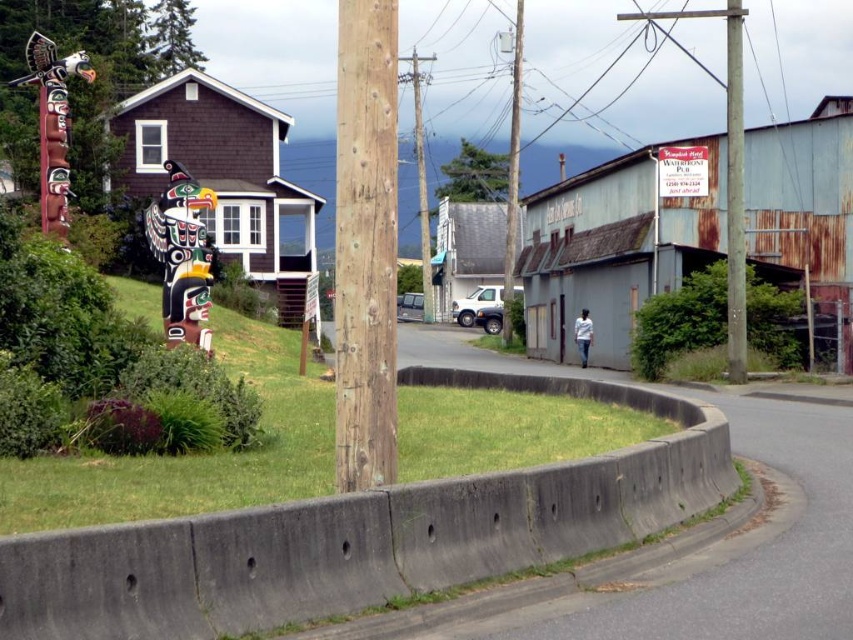
Is brown rough wood at center wider than polished wood totem pole at upper left?

No, brown rough wood at center is not wider than polished wood totem pole at upper left.

Who is more forward, (x=346, y=289) or (x=90, y=83)?

Point (x=346, y=289) is in front.

Where is `brown rough wood at center`? The image size is (853, 640). brown rough wood at center is located at coordinates (364, 243).

Is point (358, 468) positioned before point (735, 252)?

That is True.

The height and width of the screenshot is (640, 853). Find the location of `brown rough wood at center`. brown rough wood at center is located at coordinates (364, 243).

This screenshot has width=853, height=640. What are the coordinates of `brown rough wood at center` in the screenshot? It's located at (364, 243).

Who is positioned more to the right, smooth wooden pole at center or smooth wooden telegraph pole at center?

From the viewer's perspective, smooth wooden pole at center appears more on the right side.

Who is taller, smooth wooden pole at center or smooth wooden telegraph pole at center?

Standing taller between the two is smooth wooden pole at center.

Measure the distance between smooth wooden pole at center and camera.

The distance of smooth wooden pole at center from camera is 46.54 meters.

Locate an element on the screen. The width and height of the screenshot is (853, 640). smooth wooden pole at center is located at coordinates (512, 173).